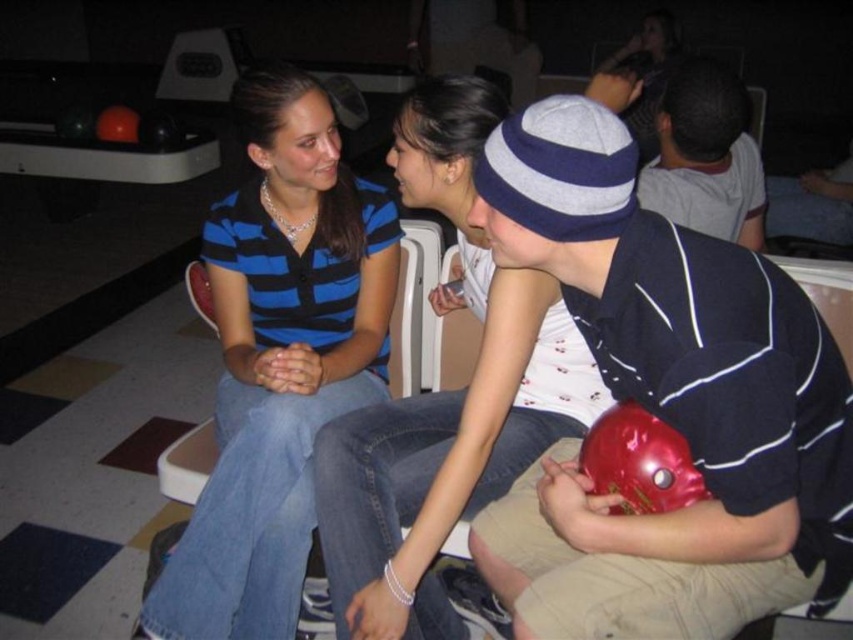
Question: Which of these objects is positioned closest to the shiny red bowling ball at center?

Choices:
 (A) matte blue shirt at center
 (B) blue striped shirt at center

Answer: (A)

Question: Is matte blue shirt at center smaller than gray cotton shirt at upper right?

Choices:
 (A) no
 (B) yes

Answer: (A)

Question: Does shiny red bowling ball at center have a lesser width compared to matte blue shirt at center?

Choices:
 (A) no
 (B) yes

Answer: (B)

Question: Is shiny red bowling ball at center smaller than matte blue shirt at center?

Choices:
 (A) yes
 (B) no

Answer: (A)

Question: Which object is positioned closest to the shiny red bowling ball at center?

Choices:
 (A) gray cotton shirt at upper right
 (B) blue striped shirt at center

Answer: (B)

Question: Considering the real-world distances, which object is closest to the blue striped shirt at center?

Choices:
 (A) gray cotton shirt at upper right
 (B) shiny red bowling ball at center

Answer: (B)